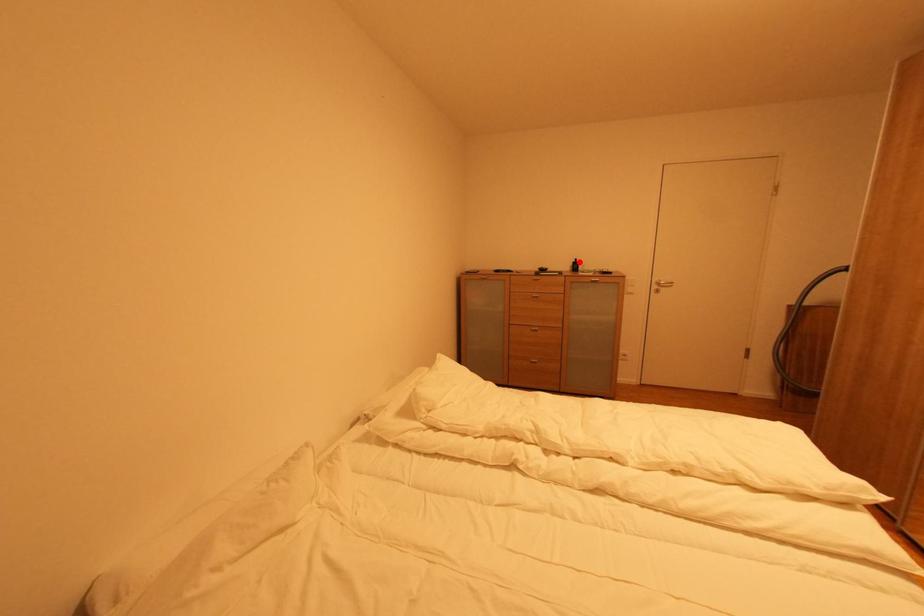
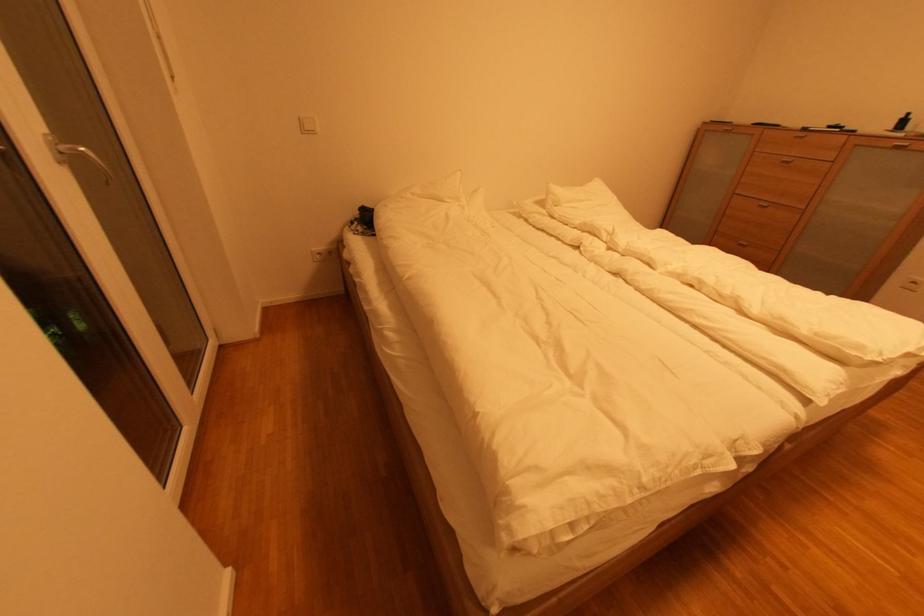
Question: I am providing you with two images of the same scene from different viewpoints. In image1, a red point is highlighted. Considering the same 3D point in image2, which of the following is correct?

Choices:
 (A) It is closer
 (B) It is farther

Answer: (B)